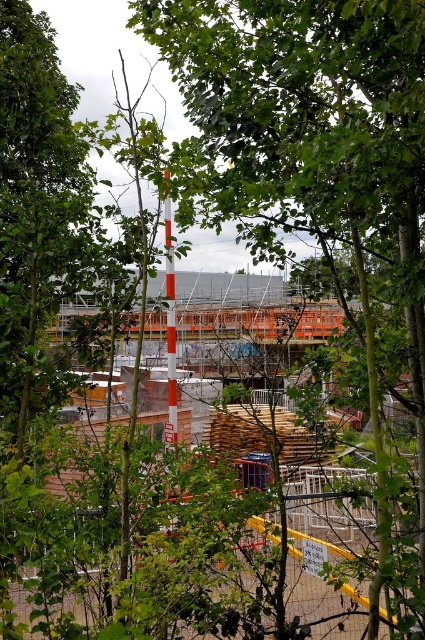
You are a safety inspector checking the construction site through the trees. You notice the yellow metal fence at lower center and the smooth orange pole at center. Which object is taller?

The smooth orange pole at center is taller than the yellow metal fence at lower center.